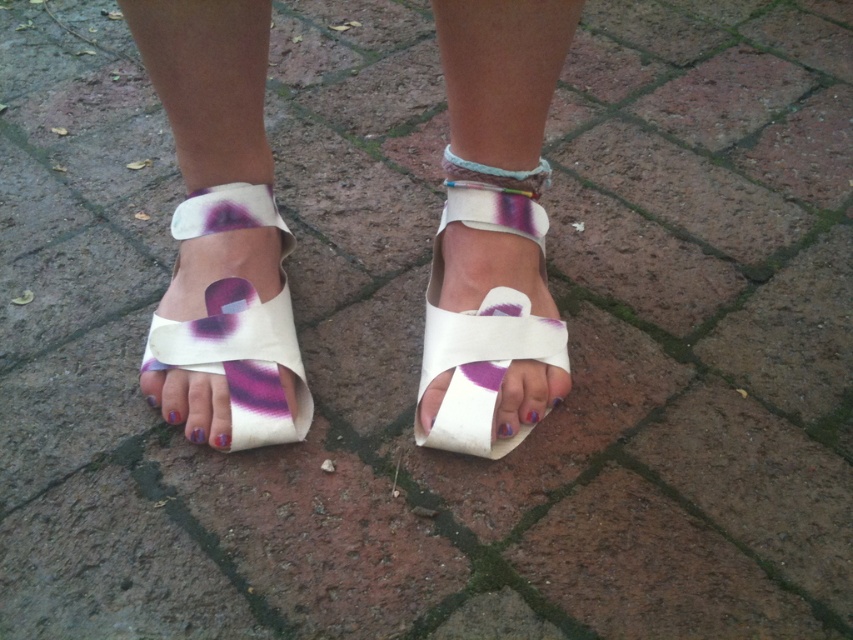
Question: Does white leather sandals at center have a smaller size compared to white leather sandal at lower left?

Choices:
 (A) no
 (B) yes

Answer: (A)

Question: Among these points, which one is nearest to the camera?

Choices:
 (A) (474, 170)
 (B) (199, 340)

Answer: (B)

Question: Which object is positioned closest to the white leather sandal at lower left?

Choices:
 (A) white leather sandals at center
 (B) white matte sandal at center
 (C) multicolored woven bracelet at center

Answer: (A)

Question: Can you confirm if white leather sandal at lower left is positioned to the right of multicolored woven bracelet at center?

Choices:
 (A) no
 (B) yes

Answer: (A)

Question: Does white matte sandal at center lie behind multicolored woven bracelet at center?

Choices:
 (A) yes
 (B) no

Answer: (B)

Question: Which object is the closest to the white leather sandals at center?

Choices:
 (A) multicolored woven bracelet at center
 (B) white leather sandal at lower left
 (C) white matte sandal at center

Answer: (C)